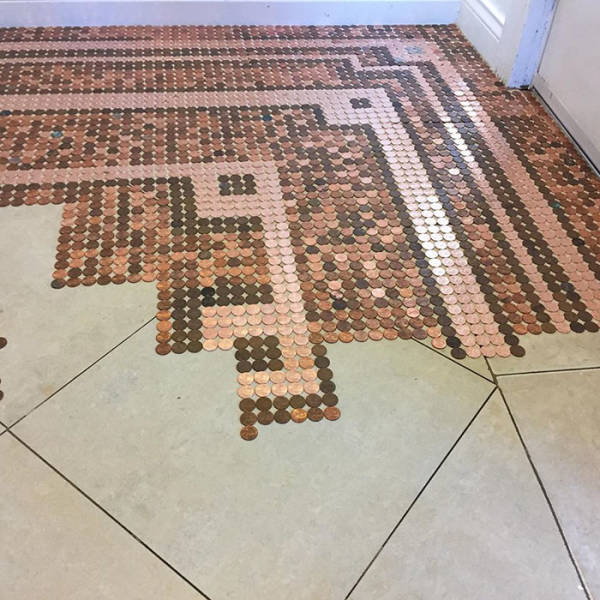
Find the location of a particular element. The width and height of the screenshot is (600, 600). corner of room is located at coordinates (452, 25).